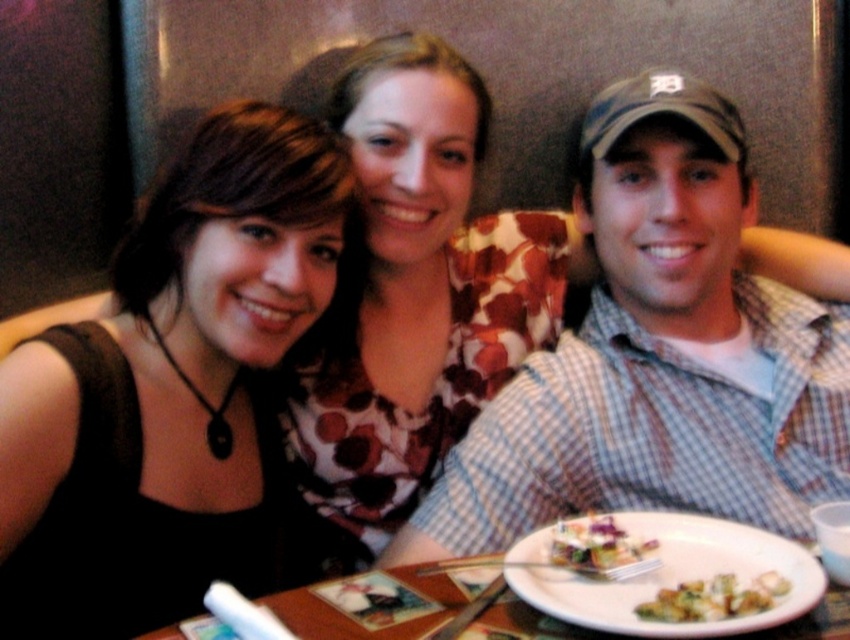
Is black fabric dress at left shorter than green leafy vegetables at center?

In fact, black fabric dress at left may be taller than green leafy vegetables at center.

Measure the distance between point (166,576) and camera.

A distance of 1.06 meters exists between point (166,576) and camera.

Where is `black fabric dress at left`? The width and height of the screenshot is (850, 640). black fabric dress at left is located at coordinates (170, 388).

Which is more to the right, white ceramic plate at center or green leafy salad at center?

white ceramic plate at center

Between white ceramic plate at center and green leafy salad at center, which one appears on the left side from the viewer's perspective?

green leafy salad at center

The width and height of the screenshot is (850, 640). Find the location of `white ceramic plate at center`. white ceramic plate at center is located at coordinates (677, 577).

Can you confirm if white ceramic plate at center is positioned to the left of white plate at center?

No, white ceramic plate at center is not to the left of white plate at center.

Can you confirm if white ceramic plate at center is positioned below white plate at center?

No.

Between point (633, 634) and point (775, 636), which one is positioned behind?

The point (775, 636) is behind.

This screenshot has width=850, height=640. Find the location of `white ceramic plate at center`. white ceramic plate at center is located at coordinates (677, 577).